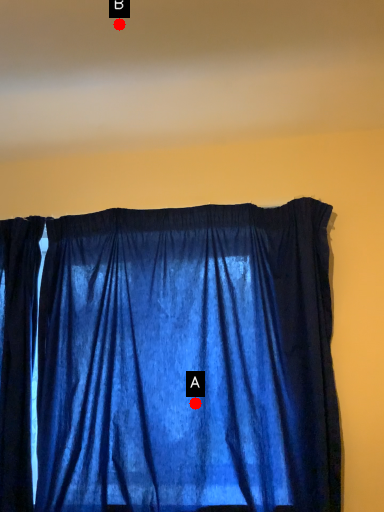
Question: Two points are circled on the image, labeled by A and B beside each circle. Which point is farther to the camera?

Choices:
 (A) A is further
 (B) B is further

Answer: (A)